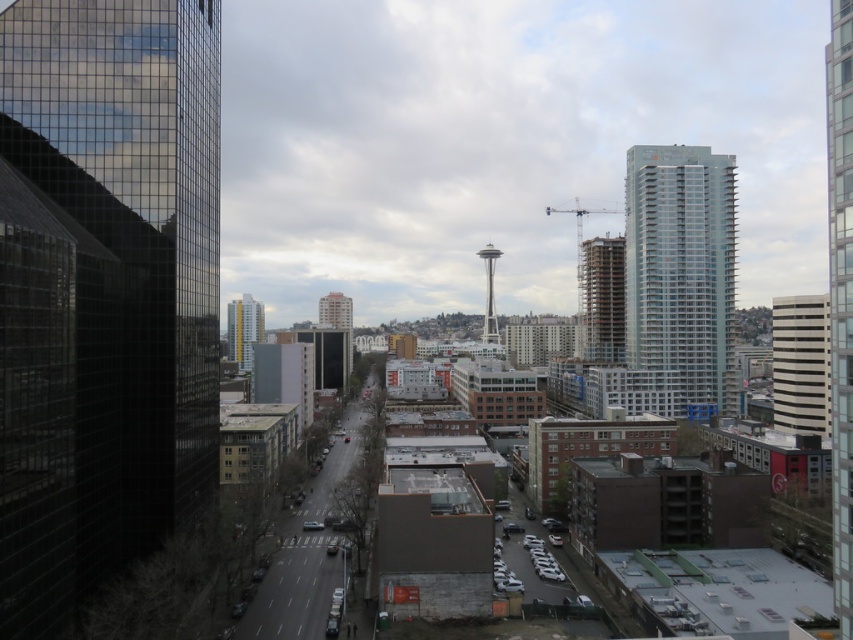
You are a drone operator trying to navigate between two points in the urban landscape. The first point is at coordinate point (815, 378) and the second is at point (618, 273). Based on the image, which point is closer to the observer?

Point (815, 378) is in front of point (618, 273), so it is closer to the observer.

You are a drone operator trying to navigate between two points in the urban landscape. You need to fly from point A to point B. Given that point A is at coordinates point(674, 282) and point B is at point(843, 26), which point is closer to you, the operator, so you can plan your flight path accordingly?

Point(674, 282) is closer to you than point(843, 26) because it is further to the viewer, meaning it is nearer in the visual perspective.

You are a city planner reviewing this urban layout. You need to determine the relative positioning of the matte glass building at center and the white glass tower at center. Which one is positioned to the left when viewed from this perspective?

The matte glass building at center is positioned to the left of the white glass tower at center.